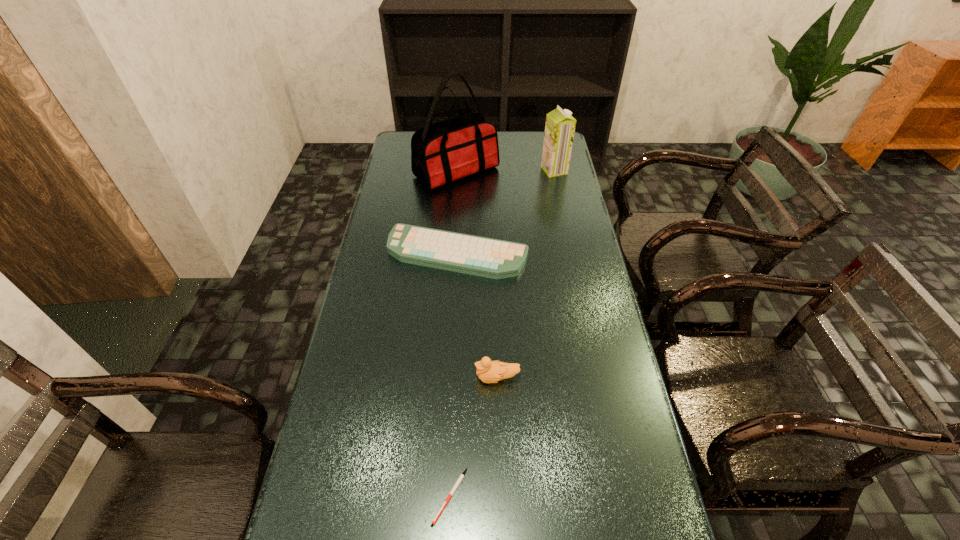
Where is `vacant space situated on the back of the rightmost object`? vacant space situated on the back of the rightmost object is located at coordinates (545, 130).

Find the location of a particular element. The image size is (960, 540). free spot located 0.290m on the face of the second nearest object is located at coordinates (364, 378).

I want to click on vacant space located on the face of the second nearest object, so click(357, 378).

Identify the location of free region located 0.240m on the face of the second nearest object. The image size is (960, 540). (383, 378).

At what (x,y) coordinates should I click in order to perform the action: click on vacant region located 0.320m on the back of the second shortest object. Please return your answer as a coordinate pair (x, y). Looking at the image, I should click on (462, 179).

I want to click on object that is at the far edge, so click(442, 152).

This screenshot has width=960, height=540. Identify the location of duffel bag present at the left edge. (442, 152).

Where is `computer keyboard that is positioned at the left edge`? The height and width of the screenshot is (540, 960). computer keyboard that is positioned at the left edge is located at coordinates (480, 256).

In order to click on object that is positioned at the right edge in this screenshot , I will do `click(560, 126)`.

Where is `object that is at the far left corner`? This screenshot has height=540, width=960. object that is at the far left corner is located at coordinates (442, 152).